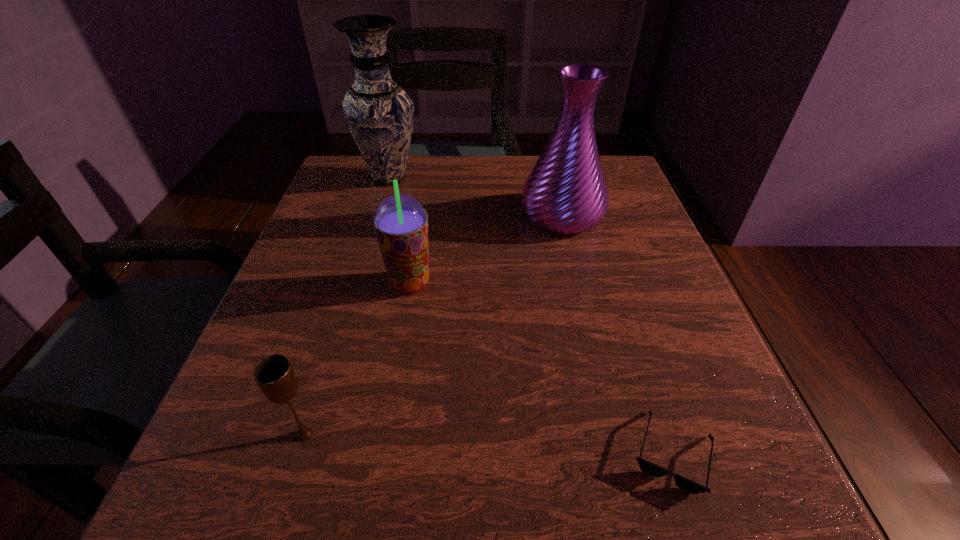
Find the location of `the left vase`. the left vase is located at coordinates (379, 113).

Find the location of a particular element. The image size is (960, 540). the right vase is located at coordinates (566, 192).

Identify the location of the third farthest object. (401, 223).

Identify the location of the third tallest object. Image resolution: width=960 pixels, height=540 pixels. (401, 223).

Locate an element on the screen. This screenshot has width=960, height=540. chalice is located at coordinates (274, 375).

Locate an element on the screen. The width and height of the screenshot is (960, 540). the shortest object is located at coordinates (647, 467).

Where is `vacant space located on the front of the left vase`? vacant space located on the front of the left vase is located at coordinates (352, 303).

Where is `vacant space located on the left of the right vase`? vacant space located on the left of the right vase is located at coordinates pos(456,215).

Find the location of a particular element. This screenshot has height=540, width=960. vacant area situated on the back of the third nearest object is located at coordinates (428, 172).

Locate an element on the screen. Image resolution: width=960 pixels, height=540 pixels. free space located on the right of the chalice is located at coordinates (461, 435).